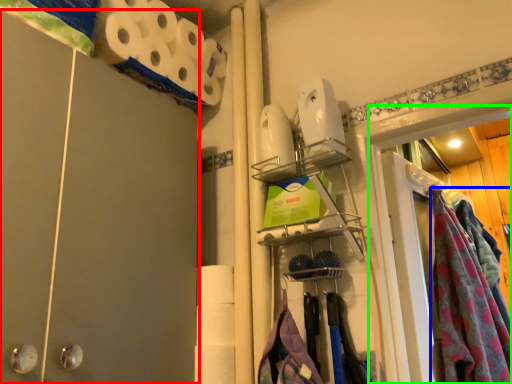
Question: Considering the real-world distances, which object is farthest from barn door (highlighted by a red box)? clothing (highlighted by a blue box) or glass door (highlighted by a green box)?

Choices:
 (A) clothing
 (B) glass door

Answer: (A)